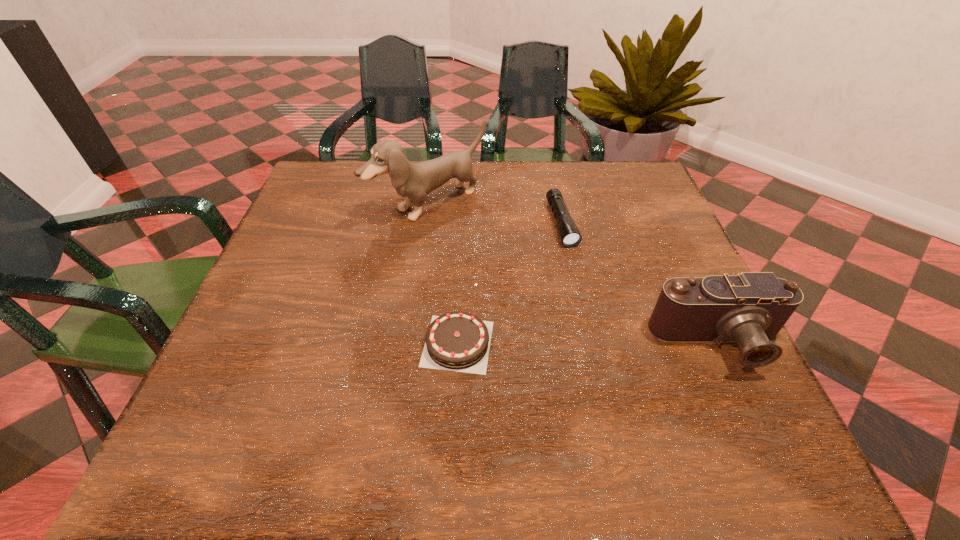
Where is `free space located 0.400m at the lens end of the third object from left to right`? Image resolution: width=960 pixels, height=540 pixels. free space located 0.400m at the lens end of the third object from left to right is located at coordinates (631, 407).

Identify the location of vacant space located 0.120m at the lens end of the third object from left to right. (583, 286).

Identify the location of puppy at the far edge. The height and width of the screenshot is (540, 960). (413, 182).

I want to click on flashlight at the far edge, so click(x=570, y=236).

Locate an element on the screen. chocolate cake that is at the near edge is located at coordinates point(457,341).

I want to click on camera present at the near edge, so click(x=750, y=308).

Where is `object located in the right edge section of the desktop`? The width and height of the screenshot is (960, 540). object located in the right edge section of the desktop is located at coordinates (750, 308).

Locate an element on the screen. Image resolution: width=960 pixels, height=540 pixels. object that is at the near right corner is located at coordinates (750, 308).

Where is `free space at the far edge`? The image size is (960, 540). free space at the far edge is located at coordinates tap(512, 196).

Image resolution: width=960 pixels, height=540 pixels. In the image, there is a desktop. What are the coordinates of `vacant space at the near edge` in the screenshot? It's located at (482, 382).